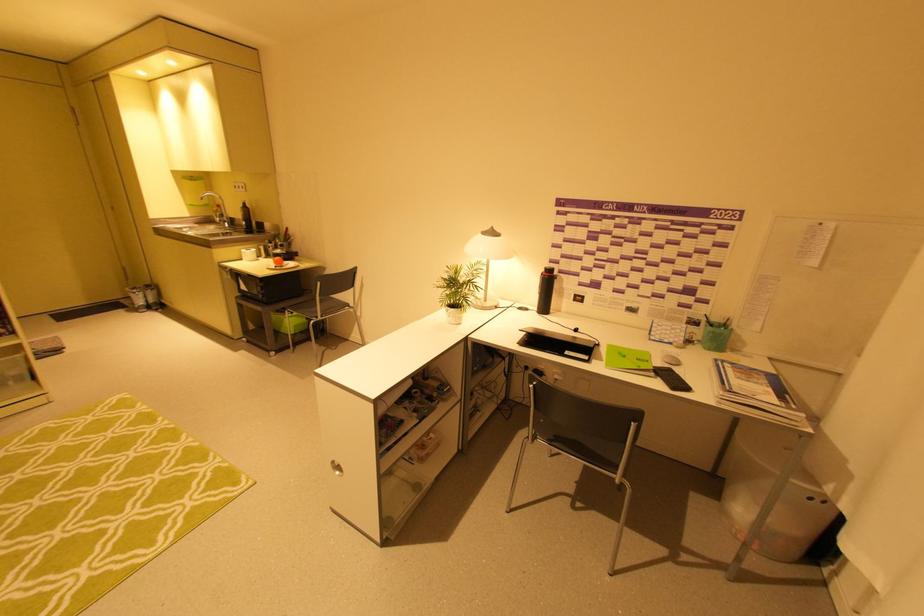
Which object does [772,493] point to?

This point indicates the white trash can.